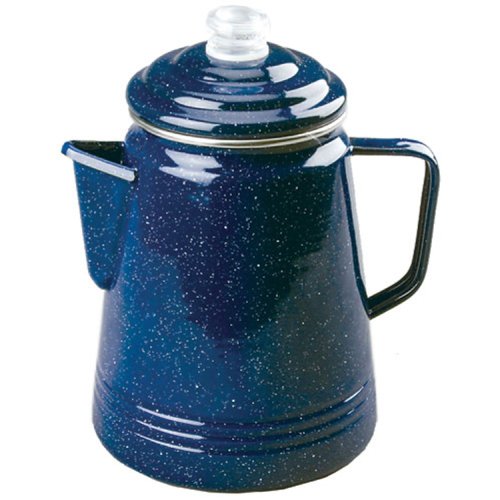
The height and width of the screenshot is (500, 500). Find the location of `teapot`. teapot is located at coordinates (214, 312).